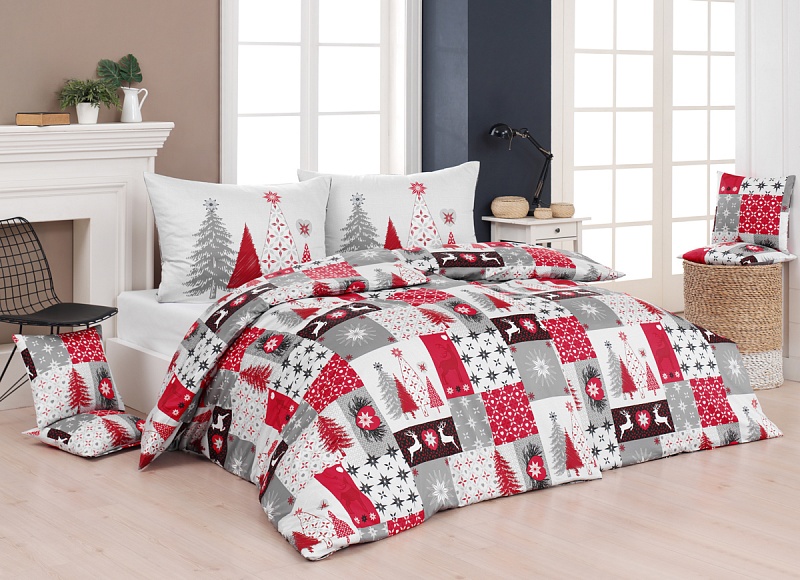
Locate an element on the screen. Image resolution: width=800 pixels, height=580 pixels. black chair is located at coordinates (46, 261).